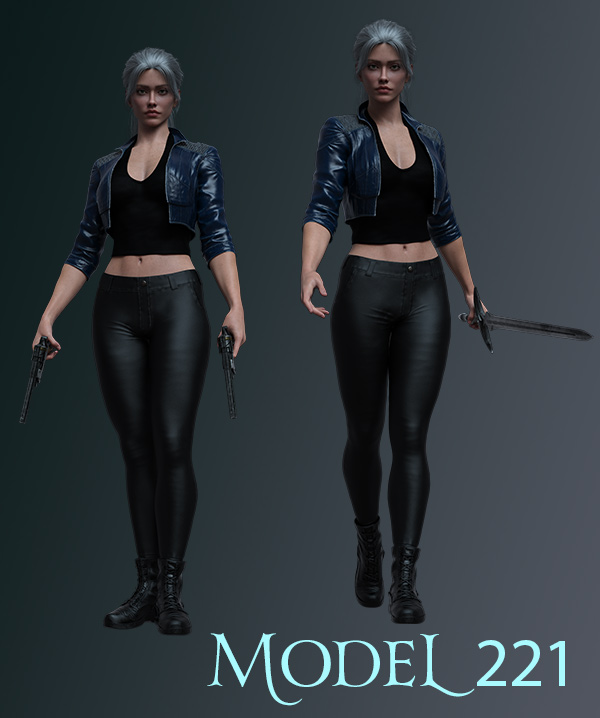
You are a GUI agent. You are given a task and a screenshot of the screen. Output one action in this format:
    pyautogui.click(x=<x>, y=<y>)
    Task: Click on the floor
    This screenshot has width=600, height=718.
    Given the screenshot: What is the action you would take?
    pyautogui.click(x=103, y=673)